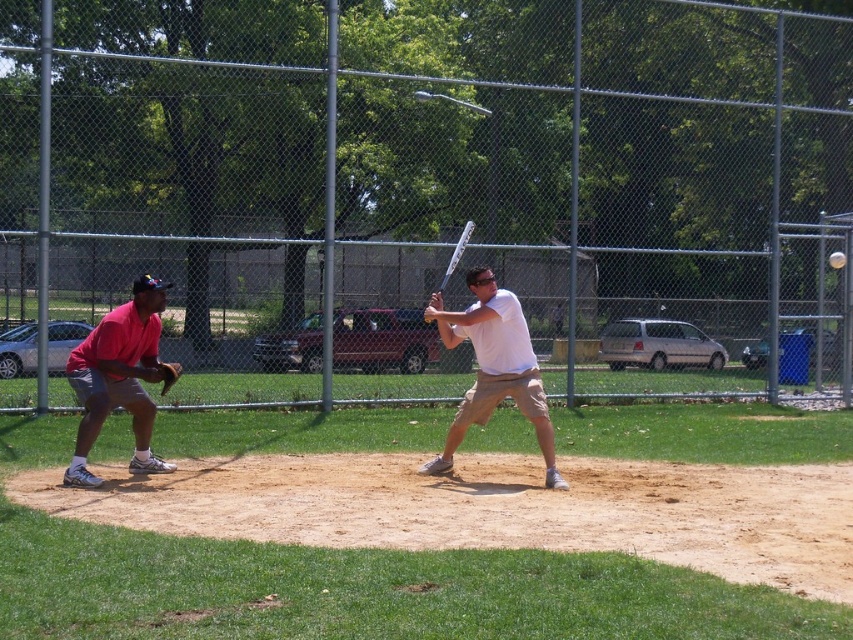
You are a baseball coach observing the game. You need to determine if the distance between the matte pink shirt at left and the silver metallic bat at center is sufficient for a runner to slide safely into home plate. The minimum safe distance required is 10 feet. Is the current distance sufficient?

The distance between the matte pink shirt at left and the silver metallic bat at center is 9.64 feet, which is less than the required 10 feet. Therefore, the distance is not sufficient for a runner to slide safely into home plate.

You are a spectator at the baseball game and want to know where the white matte baseball bat at center is positioned relative to the catcher and batter. Can you determine its location?

The white matte baseball bat at center is located at point coordinates [492,368], which places it centrally in the image between the catcher on the left and the batter on the right.